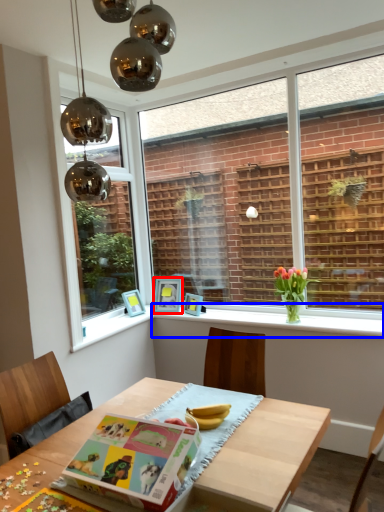
Question: Which of the following is the farthest to the observer, picture frame (highlighted by a red box) or window sill (highlighted by a blue box)?

Choices:
 (A) picture frame
 (B) window sill

Answer: (A)